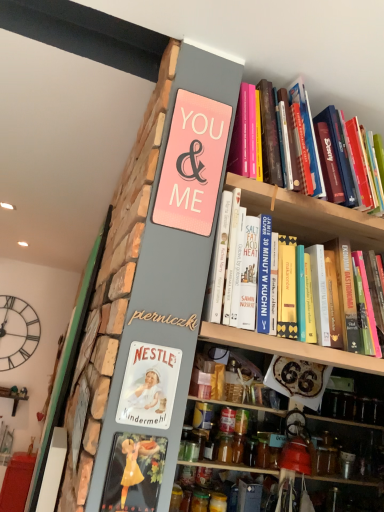
Question: Considering the relative sizes of hardcover books at upper right, which is counted as the second book, starting from the bottom, and gold wood sign at center in the image provided, is hardcover books at upper right, which is counted as the second book, starting from the bottom, bigger than gold wood sign at center?

Choices:
 (A) no
 (B) yes

Answer: (B)

Question: Does hardcover books at upper right, which is counted as the second book, starting from the bottom, appear on the left side of gold wood sign at center?

Choices:
 (A) no
 (B) yes

Answer: (A)

Question: Is hardcover books at upper right, which is counted as the second book, starting from the bottom, aimed at gold wood sign at center?

Choices:
 (A) yes
 (B) no

Answer: (B)

Question: Is hardcover books at upper right, which is counted as the first book, starting from the top, positioned before gold wood sign at center?

Choices:
 (A) no
 (B) yes

Answer: (A)

Question: From a real-world perspective, is hardcover books at upper right, which is counted as the second book, starting from the bottom, positioned under gold wood sign at center based on gravity?

Choices:
 (A) no
 (B) yes

Answer: (A)

Question: From the image's perspective, is hardcover books at upper right, which is counted as the second book, starting from the bottom, on gold wood sign at center?

Choices:
 (A) no
 (B) yes

Answer: (B)

Question: Could gold wood sign at center be considered to be inside black metal clock at upper left?

Choices:
 (A) no
 (B) yes

Answer: (A)

Question: Is black metal clock at upper left positioned beyond the bounds of gold wood sign at center?

Choices:
 (A) yes
 (B) no

Answer: (A)

Question: Can you confirm if black metal clock at upper left is smaller than gold wood sign at center?

Choices:
 (A) yes
 (B) no

Answer: (B)

Question: Is black metal clock at upper left turned away from gold wood sign at center?

Choices:
 (A) yes
 (B) no

Answer: (B)

Question: Is black metal clock at upper left further to camera compared to gold wood sign at center?

Choices:
 (A) no
 (B) yes

Answer: (B)

Question: Can you confirm if black metal clock at upper left is bigger than gold wood sign at center?

Choices:
 (A) no
 (B) yes

Answer: (B)

Question: Is pink matte sign at upper center outside translucent glass jar at lower center, which appears as the 2th glass jar when viewed from the left?

Choices:
 (A) no
 (B) yes

Answer: (B)